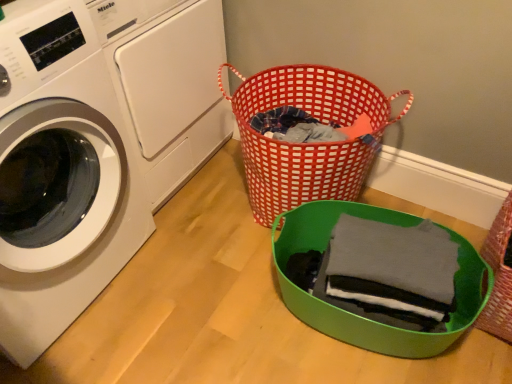
Locate an element on the screen. Image resolution: width=512 pixels, height=384 pixels. free space to the left of green plastic basket at lower right, positioned as the second basket in right-to-left order is located at coordinates (196, 292).